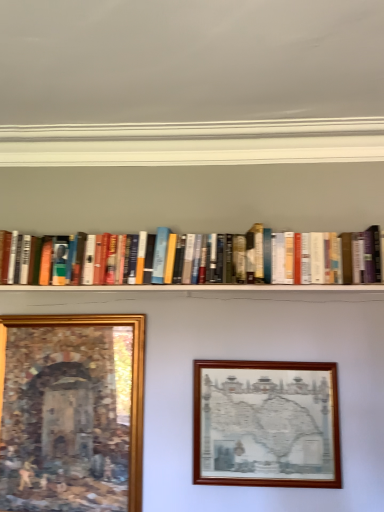
Image resolution: width=384 pixels, height=512 pixels. I want to click on empty space that is ontop of wooden picture frame at center, the first picture frame from the right (from a real-world perspective), so click(273, 358).